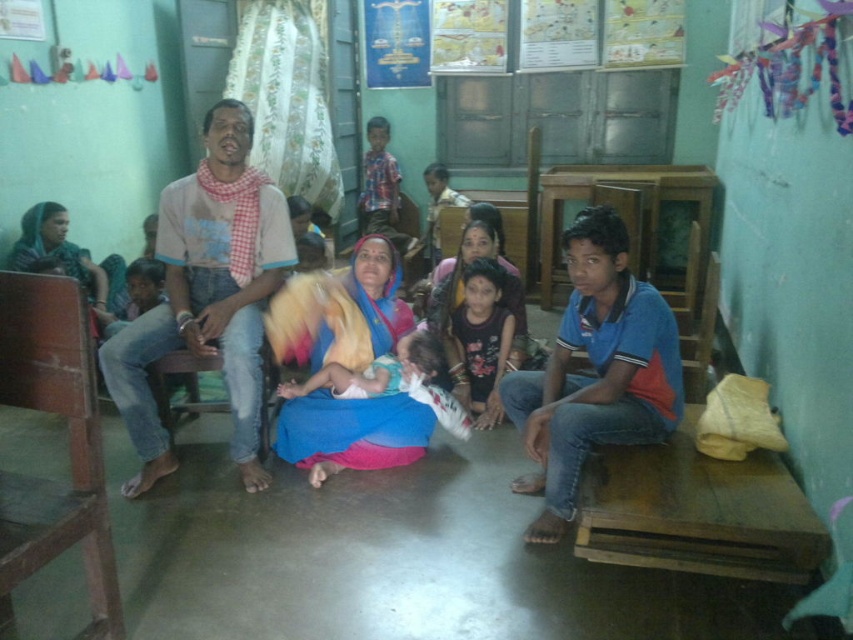
Is point (218, 340) positioned behind point (474, 388)?

That is False.

I want to click on light brown cotton shirt at left, so (207, 294).

Which of these two, blue fabric dress at center or dark blue fabric dress at center, stands shorter?

dark blue fabric dress at center

Which is behind, point (612, 227) or point (486, 268)?

The point (486, 268) is behind.

I want to click on blue fabric dress at center, so click(x=596, y=369).

Does blue cotton shirt at right appear on the right side of dark blue fabric dress at center?

Correct, you'll find blue cotton shirt at right to the right of dark blue fabric dress at center.

Measure the distance between point (665, 381) and camera.

Point (665, 381) is 2.44 meters from camera.

Image resolution: width=853 pixels, height=640 pixels. Find the location of `blue cotton shirt at right`. blue cotton shirt at right is located at coordinates (595, 371).